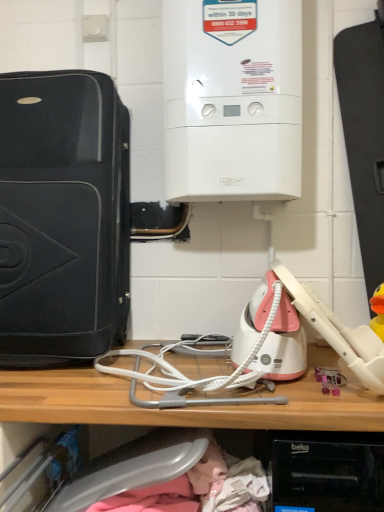
This screenshot has width=384, height=512. In order to click on free point in front of pink plastic toy at lower right in this screenshot , I will do `click(335, 401)`.